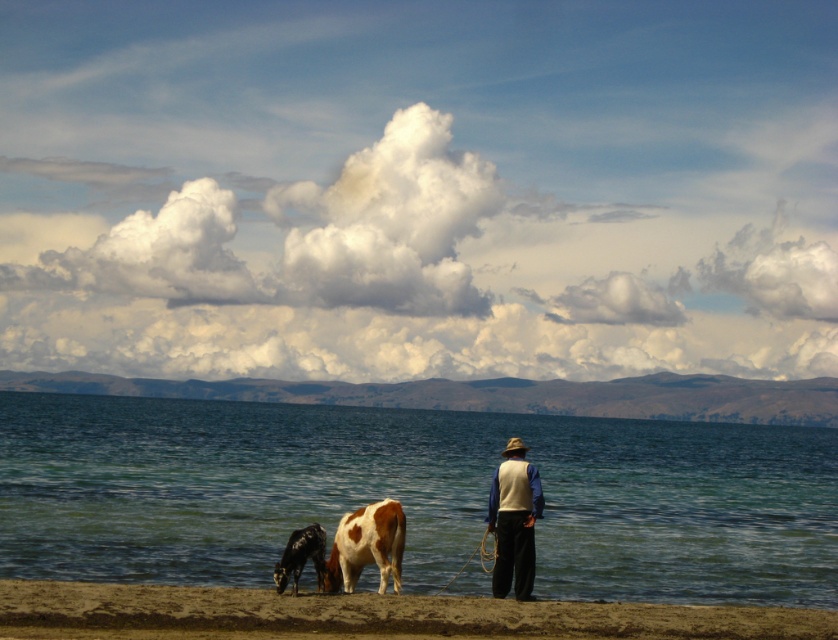
How distant is brown sand at lower center from black glossy cow at lower left?

brown sand at lower center is 3.00 meters away from black glossy cow at lower left.

Is brown sand at lower center closer to camera compared to black glossy cow at lower left?

Yes.

Between point (16, 586) and point (273, 577), which one is positioned behind?

The point (273, 577) is more distant.

I want to click on brown sand at lower center, so click(370, 616).

From the picture: Between clear blue water at lower center and black glossy cow at lower left, which one is positioned lower?

clear blue water at lower center is below.

Where is `clear blue water at lower center`? The height and width of the screenshot is (640, 838). clear blue water at lower center is located at coordinates (414, 496).

Which of these two, light beige vest at center or black glossy cow at lower left, stands shorter?

Standing shorter between the two is black glossy cow at lower left.

Who is more forward, (525, 445) or (314, 531)?

Point (314, 531) is in front.

Locate an element on the screen. This screenshot has width=838, height=640. light beige vest at center is located at coordinates (515, 520).